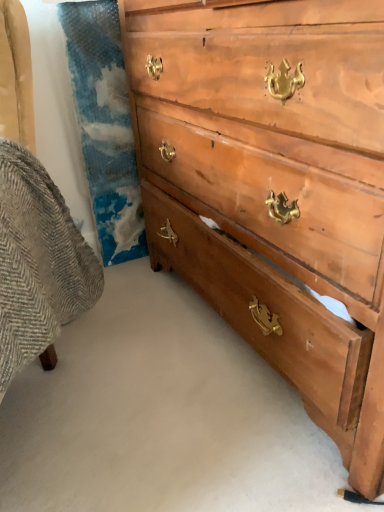
Question: Is light brown wood chest of drawers at center taller or shorter than textured gray fabric swivel chair at left?

Choices:
 (A) tall
 (B) short

Answer: (A)

Question: From the image's perspective, relative to textured gray fabric swivel chair at left, is light brown wood chest of drawers at center above or below?

Choices:
 (A) above
 (B) below

Answer: (A)

Question: In terms of size, does light brown wood chest of drawers at center appear bigger or smaller than textured gray fabric swivel chair at left?

Choices:
 (A) big
 (B) small

Answer: (A)

Question: Visually, is textured gray fabric swivel chair at left positioned to the left or to the right of light brown wood chest of drawers at center?

Choices:
 (A) left
 (B) right

Answer: (A)

Question: Looking at the image, does textured gray fabric swivel chair at left seem bigger or smaller compared to light brown wood chest of drawers at center?

Choices:
 (A) small
 (B) big

Answer: (A)

Question: Do you think textured gray fabric swivel chair at left is within light brown wood chest of drawers at center, or outside of it?

Choices:
 (A) inside
 (B) outside

Answer: (B)

Question: In terms of width, does textured gray fabric swivel chair at left look wider or thinner when compared to light brown wood chest of drawers at center?

Choices:
 (A) thin
 (B) wide

Answer: (B)